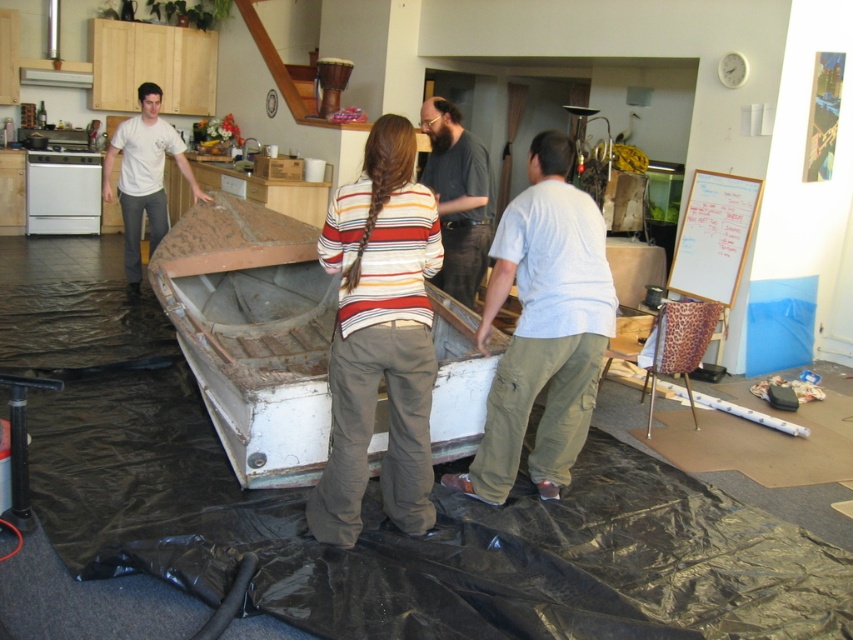
Who is higher up, dark brown leather jacket at center or white matte shirt at left?

white matte shirt at left

Measure the distance between dark brown leather jacket at center and white matte shirt at left.

dark brown leather jacket at center and white matte shirt at left are 2.40 meters apart from each other.

Is point (450, 154) in front of point (144, 177)?

That is True.

Identify the location of dark brown leather jacket at center. (457, 196).

Does striped sweater at center lie in front of dark brown leather jacket at center?

That is True.

Is striped sweater at center to the left of dark brown leather jacket at center from the viewer's perspective?

Correct, you'll find striped sweater at center to the left of dark brown leather jacket at center.

Describe the element at coordinates (379, 337) in the screenshot. I see `striped sweater at center` at that location.

This screenshot has width=853, height=640. Find the location of `striped sweater at center`. striped sweater at center is located at coordinates (379, 337).

Does rusty wood boat at center have a greater width compared to striped sweater at center?

Yes.

Is point (322, 460) positioned behind point (323, 516)?

Yes, it is behind point (323, 516).

The width and height of the screenshot is (853, 640). In order to click on rusty wood boat at center in this screenshot , I will do `click(253, 333)`.